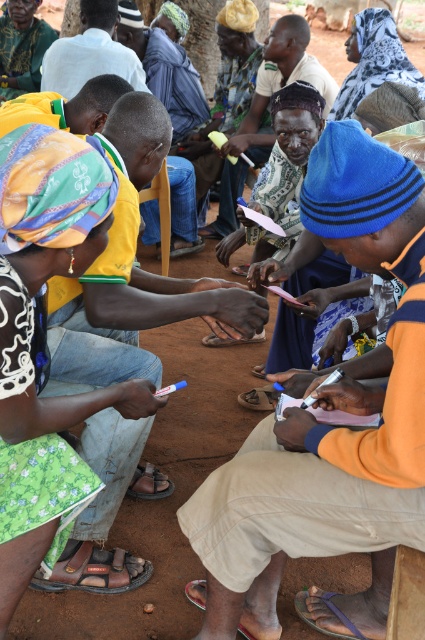
Question: Is the position of blue knit cap at center more distant than that of patterned fabric headscarf at upper center?

Choices:
 (A) no
 (B) yes

Answer: (A)

Question: Which point is closer to the camera?

Choices:
 (A) (280, 449)
 (B) (234, 140)
 (C) (104, 234)
 (D) (13, 29)

Answer: (C)

Question: Among these objects, which one is farthest from the camera?

Choices:
 (A) green fabric skirt at lower left
 (B) yellow fabric headscarf at center
 (C) blue striped hat at center
 (D) brown leather sandal at lower left

Answer: (A)

Question: Considering the real-world distances, which object is farthest from the blue knit cap at center?

Choices:
 (A) green fabric skirt at lower left
 (B) blue striped hat at center
 (C) brown leather sandal at lower left

Answer: (A)

Question: Is brown leather sandal at lower left thinner than green fabric skirt at lower left?

Choices:
 (A) yes
 (B) no

Answer: (A)

Question: From the image, what is the correct spatial relationship of brown leather sandal at lower left in relation to green fabric skirt at lower left?

Choices:
 (A) below
 (B) above

Answer: (A)